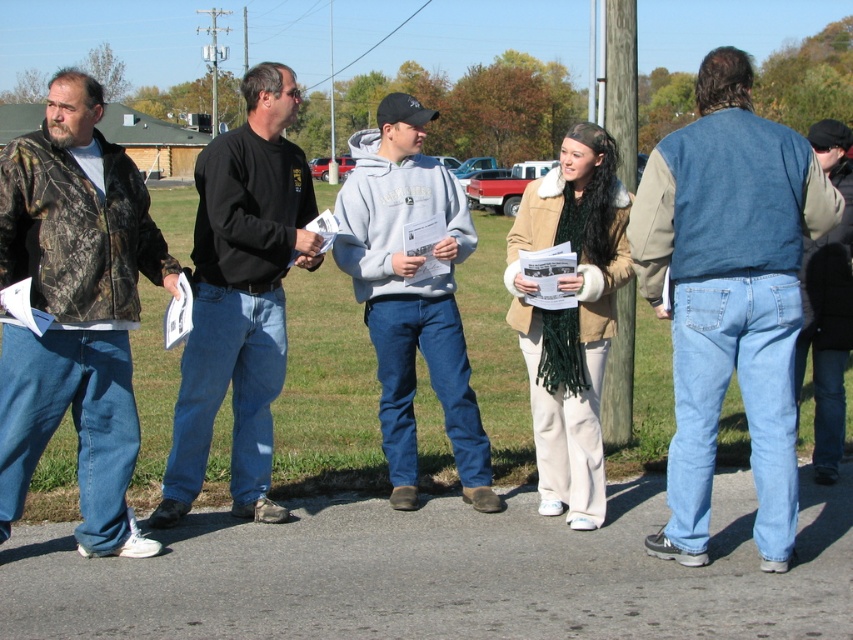
You are a GUI agent. You are given a task and a screenshot of the screen. Output one action in this format:
    pyautogui.click(x=<x>, y=<y>)
    Task: Click on the gray fleece sweatshirt at center
    This screenshot has width=853, height=640.
    Given the screenshot: What is the action you would take?
    pyautogui.click(x=410, y=292)

Is gray fleece sweatshirt at center shorter than wooden post at center?

Yes, gray fleece sweatshirt at center is shorter than wooden post at center.

Locate an element on the screen. The height and width of the screenshot is (640, 853). gray fleece sweatshirt at center is located at coordinates (410, 292).

Based on the photo, does camo jacket at left lie behind black cotton shirt at center?

No.

Does camo jacket at left have a lesser width compared to black cotton shirt at center?

Yes, camo jacket at left is thinner than black cotton shirt at center.

Find the location of a particular element. The height and width of the screenshot is (640, 853). camo jacket at left is located at coordinates (74, 308).

Locate an element on the screen. camo jacket at left is located at coordinates (74, 308).

Who is higher up, denim jacket at center or black cotton shirt at center?

black cotton shirt at center is higher up.

Consider the image. Is denim jacket at center above black cotton shirt at center?

No.

Which is behind, point (683, 474) or point (221, 234)?

The point (221, 234) is behind.

I want to click on denim jacket at center, so click(x=729, y=296).